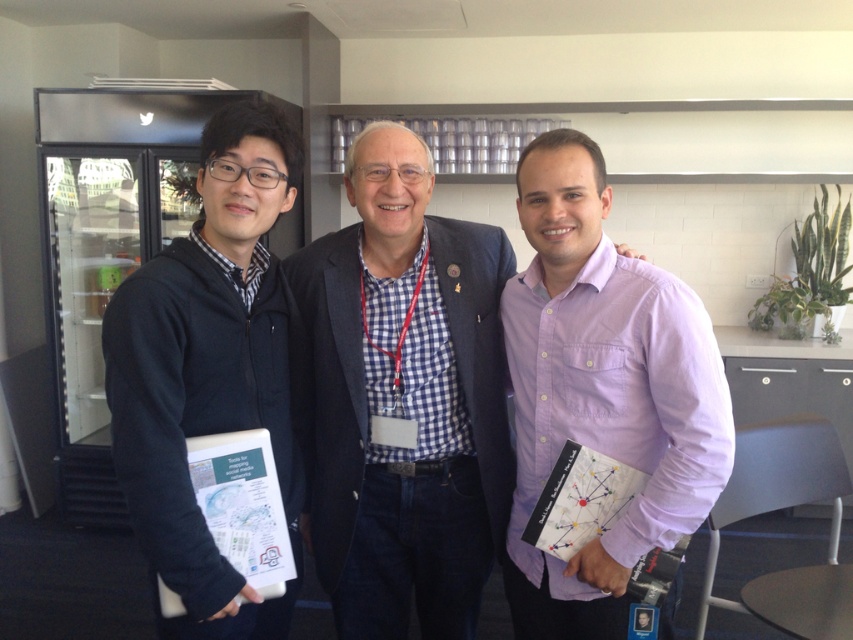
Is checkered fabric shirt at center positioned before dark blue hoodie at left?

That is False.

Between checkered fabric shirt at center and dark blue hoodie at left, which one has more height?

checkered fabric shirt at center is taller.

Is point (346, 257) in front of point (277, 634)?

No.

Identify the location of checkered fabric shirt at center. The width and height of the screenshot is (853, 640). (401, 400).

Who is positioned more to the left, checkered fabric shirt at center or purple cotton shirt at center?

From the viewer's perspective, checkered fabric shirt at center appears more on the left side.

Find the location of a particular element. This screenshot has height=640, width=853. checkered fabric shirt at center is located at coordinates (401, 400).

Is purple cotton shirt at center shorter than dark blue hoodie at left?

Indeed, purple cotton shirt at center has a lesser height compared to dark blue hoodie at left.

Who is shorter, purple cotton shirt at center or dark blue hoodie at left?

purple cotton shirt at center is shorter.

The height and width of the screenshot is (640, 853). I want to click on purple cotton shirt at center, so click(602, 392).

At what (x,y) coordinates should I click in order to perform the action: click on purple cotton shirt at center. Please return your answer as a coordinate pair (x, y). The width and height of the screenshot is (853, 640). Looking at the image, I should click on (602, 392).